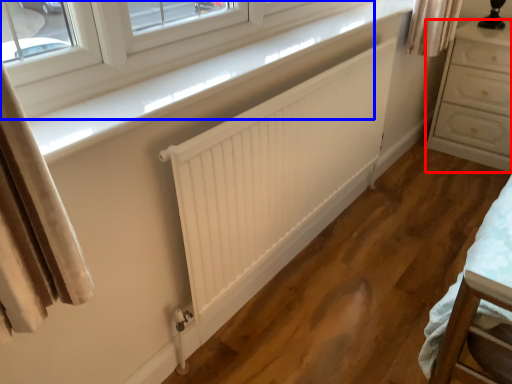
Question: Which object appears closest to the camera in this image, chest of drawers (highlighted by a red box) or window (highlighted by a blue box)?

Choices:
 (A) chest of drawers
 (B) window

Answer: (B)